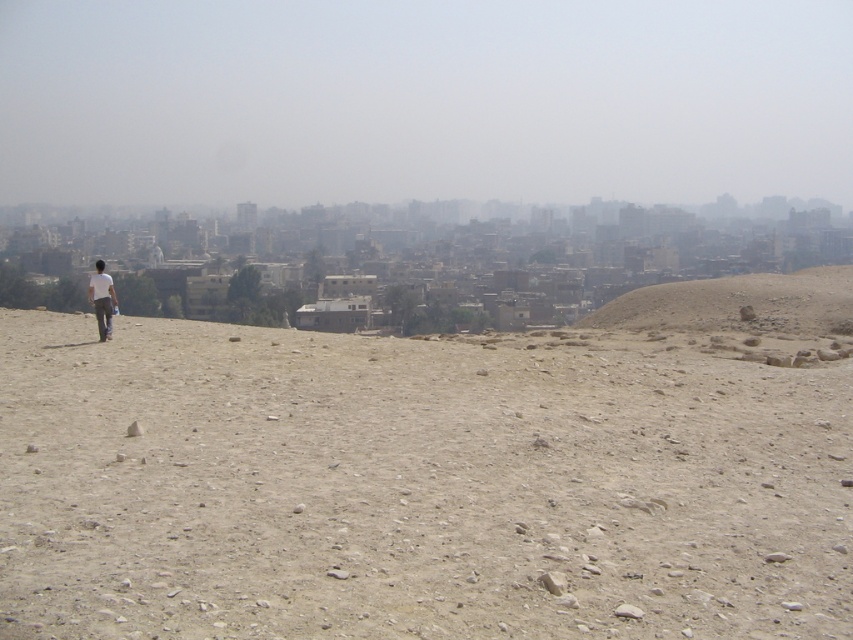
What do you see at coordinates (415, 486) in the screenshot?
I see `light brown gravel at center` at bounding box center [415, 486].

Which of these two, light brown gravel at center or white matte shirt at center, stands shorter?

Standing shorter between the two is white matte shirt at center.

Is point (564, 412) positioned behind point (90, 291)?

That is False.

At what (x,y) coordinates should I click in order to perform the action: click on light brown gravel at center. Please return your answer as a coordinate pair (x, y). This screenshot has width=853, height=640. Looking at the image, I should click on (415, 486).

Which is behind, point (831, 604) or point (683, 323)?

The point (683, 323) is more distant.

Is point (646, 445) less distant than point (787, 285)?

Yes, point (646, 445) is in front of point (787, 285).

Does point (566, 490) come behind point (819, 307)?

No, it is not.

You are a GUI agent. You are given a task and a screenshot of the screen. Output one action in this format:
    pyautogui.click(x=<x>, y=<y>)
    Task: Click on the light brown gravel at center
    
    Given the screenshot: What is the action you would take?
    pyautogui.click(x=415, y=486)

You are a GUI agent. You are given a task and a screenshot of the screen. Output one action in this format:
    pyautogui.click(x=<x>, y=<y>)
    Task: Click on the desert sand hill at right
    The image size is (853, 640).
    Given the screenshot: What is the action you would take?
    [737, 304]

Does point (635, 326) come farther from viewer compared to point (109, 336)?

Yes, it is.

You are a GUI agent. You are given a task and a screenshot of the screen. Output one action in this format:
    pyautogui.click(x=<x>, y=<y>)
    Task: Click on the desert sand hill at right
    The height and width of the screenshot is (640, 853).
    Given the screenshot: What is the action you would take?
    pyautogui.click(x=737, y=304)